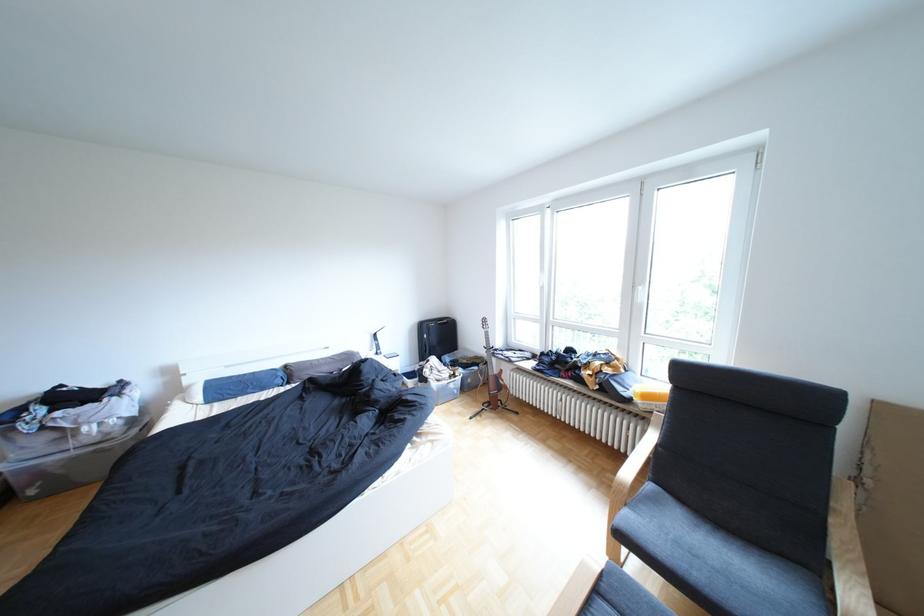
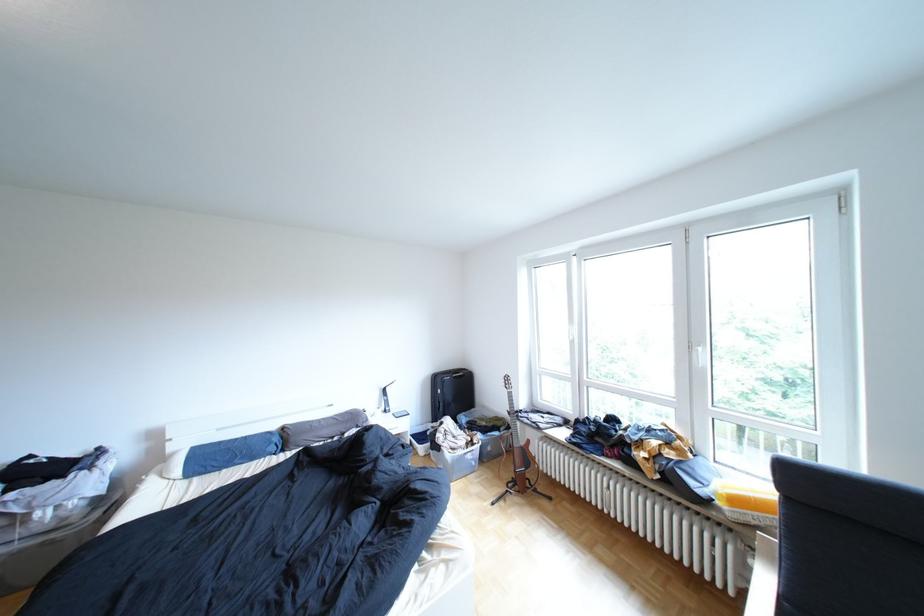
Where in the second image is the point corresponding to point (506, 379) from the first image?

(532, 453)